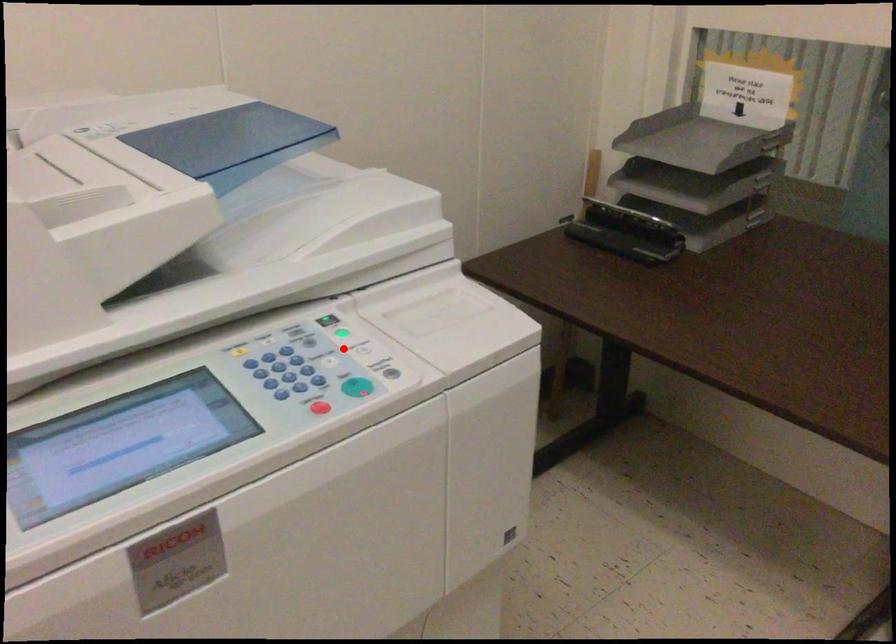
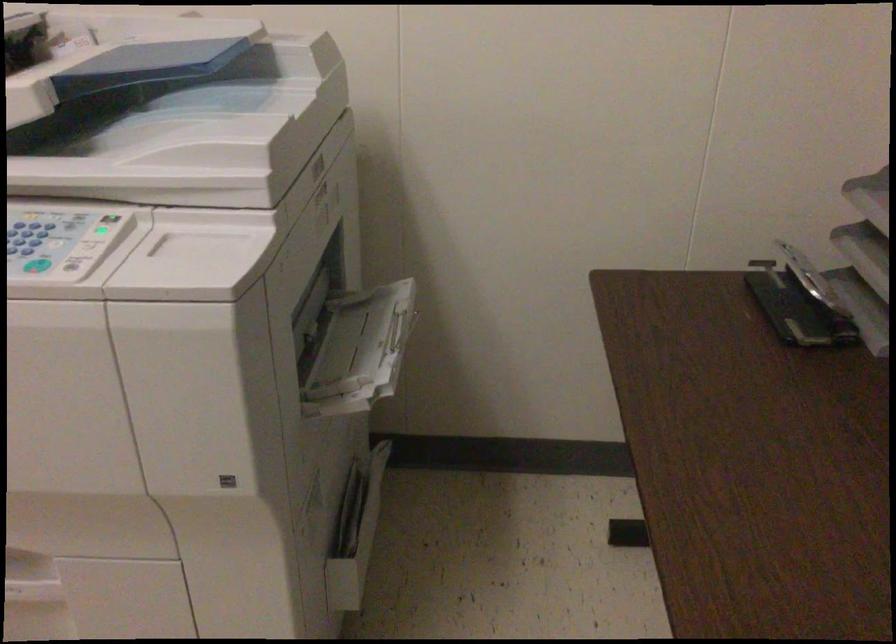
Question: I am providing you with two images of the same scene from different viewpoints. A red point is marked on the first image. Is the red point's position out of view in image 2?

Choices:
 (A) Yes
 (B) No

Answer: (B)